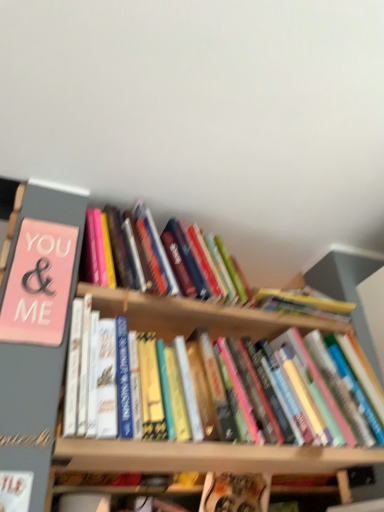
Identify the location of blank space situated above hardcover book at center, which ranks as the first book in bottom-to-top order (from a real-world perspective). The height and width of the screenshot is (512, 384). (238, 476).